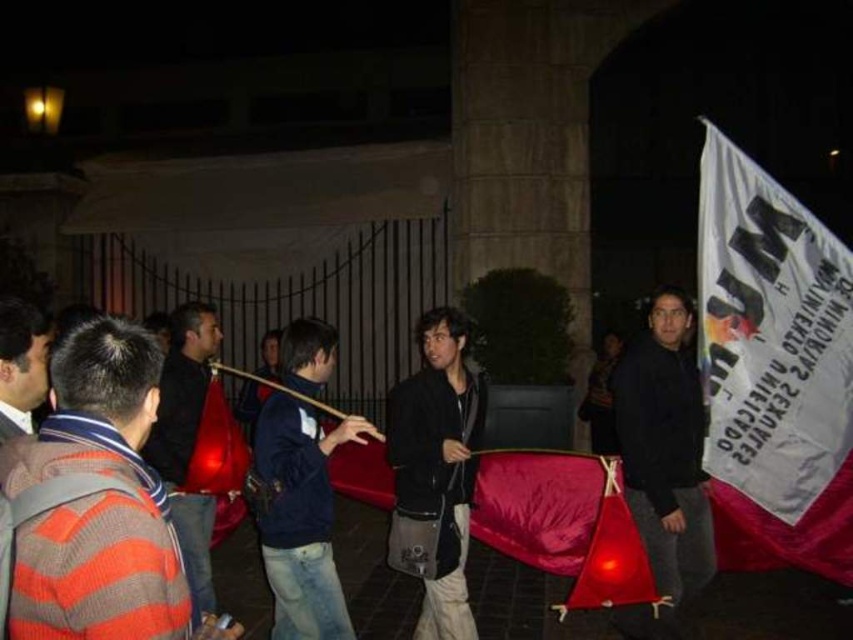
Can you confirm if white fabric banner at right is positioned to the right of navy blue jacket at center?

Correct, you'll find white fabric banner at right to the right of navy blue jacket at center.

Is white fabric banner at right further to the viewer compared to navy blue jacket at center?

Yes, white fabric banner at right is behind navy blue jacket at center.

Where is `white fabric banner at right`? The height and width of the screenshot is (640, 853). white fabric banner at right is located at coordinates (773, 369).

Where is `white fabric banner at right`? The height and width of the screenshot is (640, 853). white fabric banner at right is located at coordinates (773, 369).

Is striped wool sweater at left in front of navy blue jacket at center?

Yes, it is in front of navy blue jacket at center.

Does point (132, 468) come in front of point (291, 492)?

Yes, point (132, 468) is in front of point (291, 492).

Is point (59, 524) closer to camera compared to point (334, 444)?

That is True.

Where is `striped wool sweater at left`? The height and width of the screenshot is (640, 853). striped wool sweater at left is located at coordinates (99, 502).

Between point (787, 333) and point (637, 616), which one is positioned in front?

Point (637, 616) is in front.

Which is more to the right, white fabric banner at right or black matte jacket at right?

From the viewer's perspective, white fabric banner at right appears more on the right side.

Image resolution: width=853 pixels, height=640 pixels. What do you see at coordinates (773, 369) in the screenshot?
I see `white fabric banner at right` at bounding box center [773, 369].

The width and height of the screenshot is (853, 640). Find the location of `white fabric banner at right`. white fabric banner at right is located at coordinates (x=773, y=369).